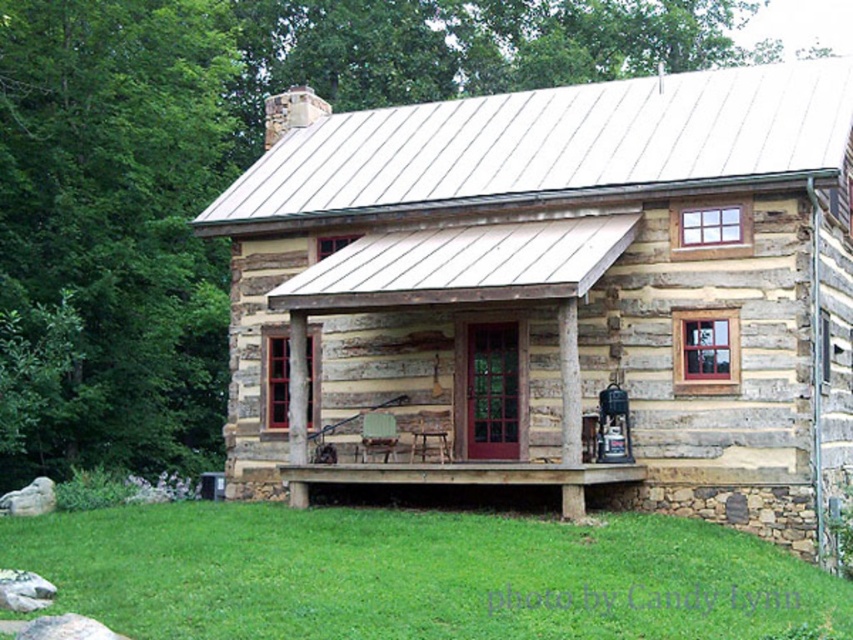
You are standing on the green grass at lower center and want to reach the brown wooden porch at center. If your walking speed is 1.2 meters per second, how many seconds will it take you to reach the porch?

The distance between the green grass at lower center and the brown wooden porch at center is 4.05 meters. At a speed of 1.2 meters per second, it would take 4.05 divided by 1.2, which equals approximately 3.375 seconds. So, it will take about 3.38 seconds to reach the porch.

You are a delivery person with a cart that is 6 meters long. You need to park your cart between the weathered wood cabin at center and the brown wooden porch at center. Is there enough space for your cart to fit between them?

The distance between the weathered wood cabin at center and the brown wooden porch at center is 5.95 meters, which is slightly less than the cart length of 6 meters. Therefore, the cart cannot fit between them.

You are standing on the porch of the weathered wood cabin at center and want to look down at the green grass at lower center. In which direction should you look?

You should look downward because the green grass at lower center is located below the weathered wood cabin at center.